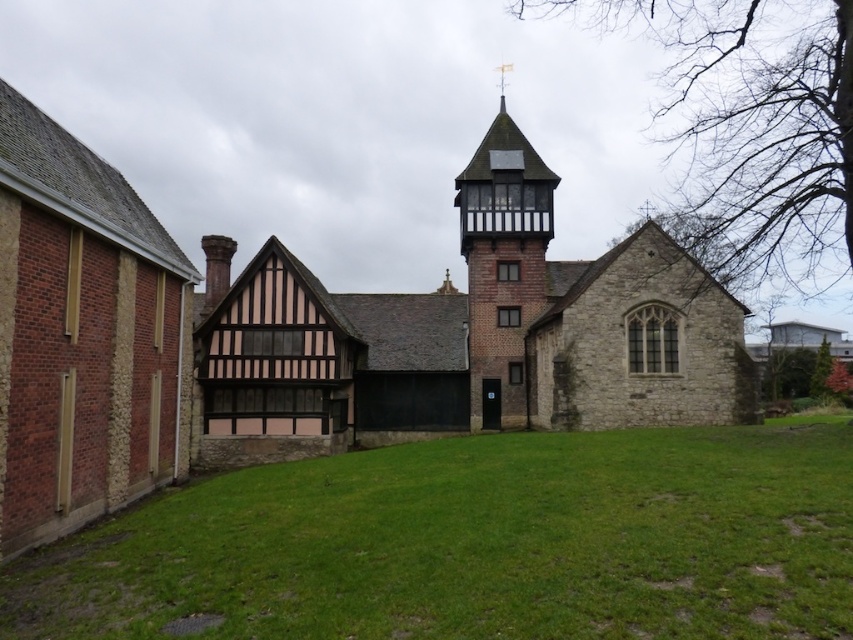
You are an architect evaluating the historic building complex. You notice the stone church at center and the brick stonework bell tower at center. Which structure would require more materials to construct due to its size?

The stone church at center is larger in size than the brick stonework bell tower at center, so it would require more materials to construct.

You are standing in the courtyard of the historic building complex. You see the green grass at center and the brick stonework bell tower at center. Which object is located below the other?

The green grass at center is positioned under the brick stonework bell tower at center, meaning the grass is below the tower.

You are standing in front of the historic building complex and want to take a photo. You notice two points marked on the building structure. Which point, point (717, 307) or point (473, 205), is closer to you?

Point (717, 307) is closer to the camera than point (473, 205), so it is closer to you.